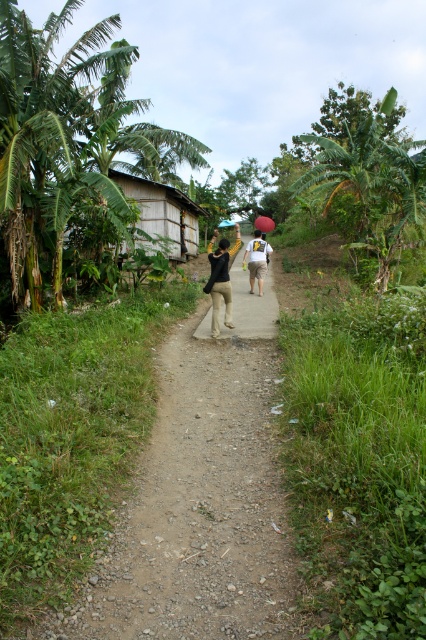
Question: Is dirt path at center behind brown fabric bag at center?

Choices:
 (A) no
 (B) yes

Answer: (A)

Question: Can you confirm if wooden hut at center is positioned below black matte shirt at center?

Choices:
 (A) no
 (B) yes

Answer: (A)

Question: Which object is positioned farthest from the black matte shirt at center?

Choices:
 (A) dirt path at center
 (B) wooden hut at center

Answer: (A)

Question: Does wooden hut at center appear on the left side of brown fabric bag at center?

Choices:
 (A) yes
 (B) no

Answer: (A)

Question: Which point is farther to the camera?

Choices:
 (A) (267, 324)
 (B) (55, 636)

Answer: (A)

Question: Which of these objects is positioned farthest from the dirt path at center?

Choices:
 (A) wooden hut at center
 (B) white fabric backpack at center

Answer: (A)